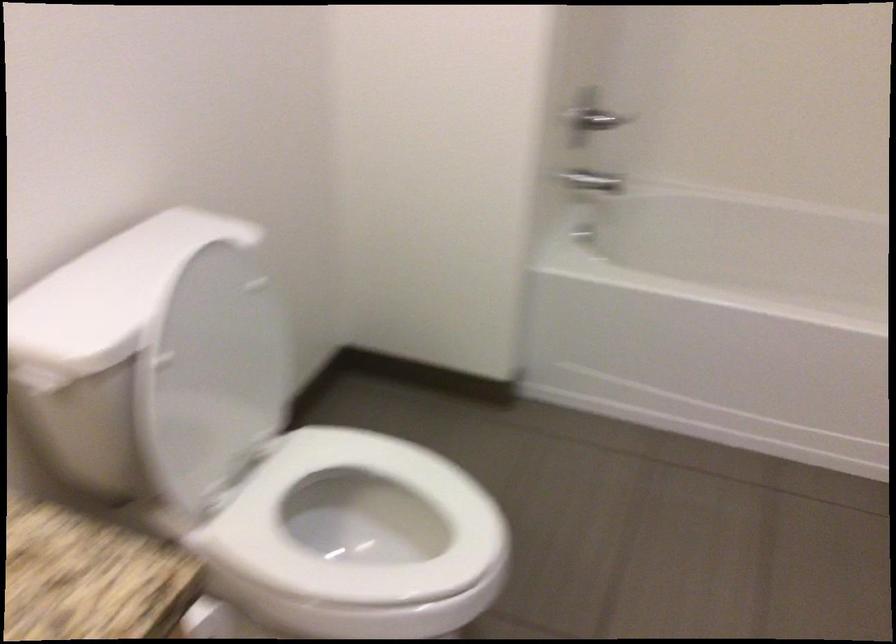
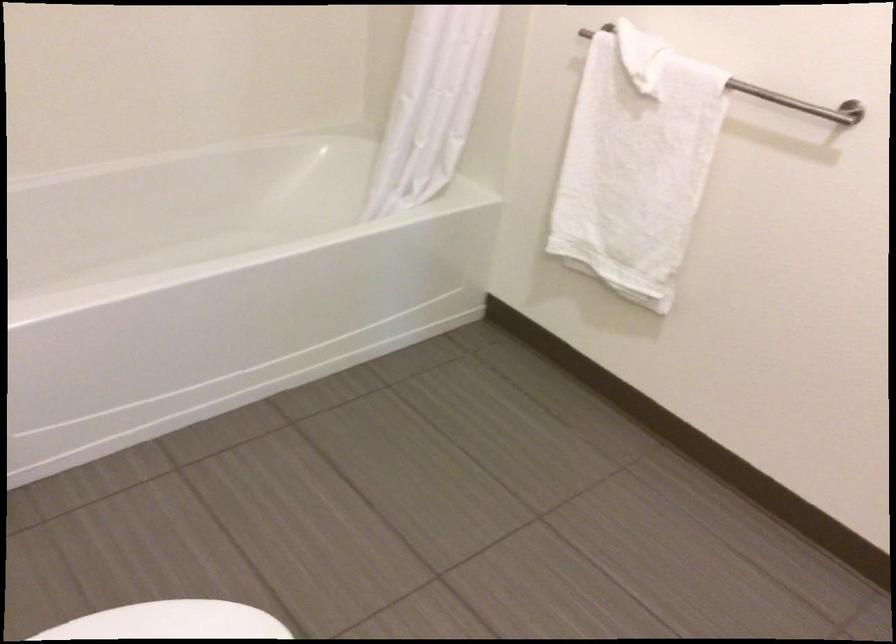
How did the camera likely rotate?

The rotation direction of the camera is right-down.